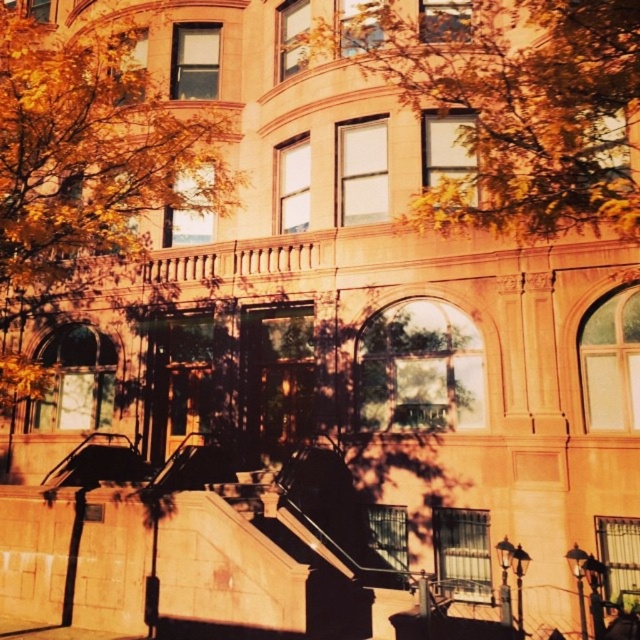
Question: Which object is closer to the camera taking this photo?

Choices:
 (A) golden textured leaves at center
 (B) yellow leafy tree at upper center

Answer: (A)

Question: Where is yellow leafy tree at upper center located in relation to golden textured leaves at center in the image?

Choices:
 (A) right
 (B) left

Answer: (A)

Question: Which object is farther from the camera taking this photo?

Choices:
 (A) golden textured leaves at center
 (B) yellow leafy tree at upper center

Answer: (B)

Question: Is yellow leafy tree at upper center wider than golden textured leaves at center?

Choices:
 (A) no
 (B) yes

Answer: (A)

Question: Is yellow leafy tree at upper center to the right of golden textured leaves at center from the viewer's perspective?

Choices:
 (A) no
 (B) yes

Answer: (B)